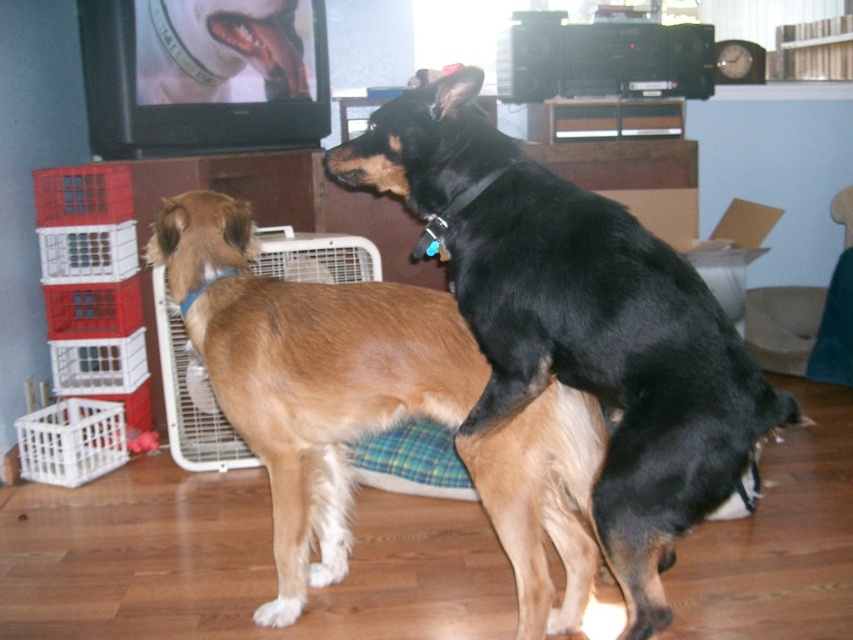
You are a visitor entering the living room and see the black smooth dog at center and the brown furry dog at center. Which dog would appear larger to you?

The black smooth dog at center appears larger because it is closer to the viewer than the brown furry dog at center.

You are a dog trainer trying to separate two dogs. You have a 30 cm wide barrier. The dogs are the black smooth dog at center and brown furry dog at center. Can the barrier fit between them?

The black smooth dog at center and brown furry dog at center are 30.09 centimeters apart, so the 30 cm wide barrier can fit between them since it is slightly narrower than the distance between the dogs.

You are a dog owner who wants to choose a dog bed for your dogs. The bed you have is designed for large dogs. Which dog between the black smooth dog at center and the brown furry dog at center is more likely to need the large dog bed?

The black smooth dog at center is much taller than the brown furry dog at center, so it is more likely to need the large dog bed.